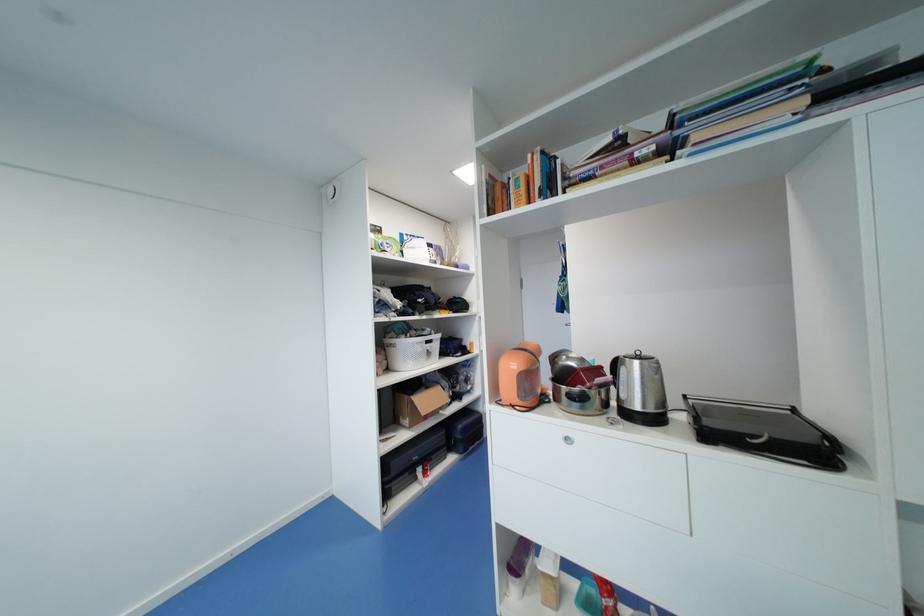
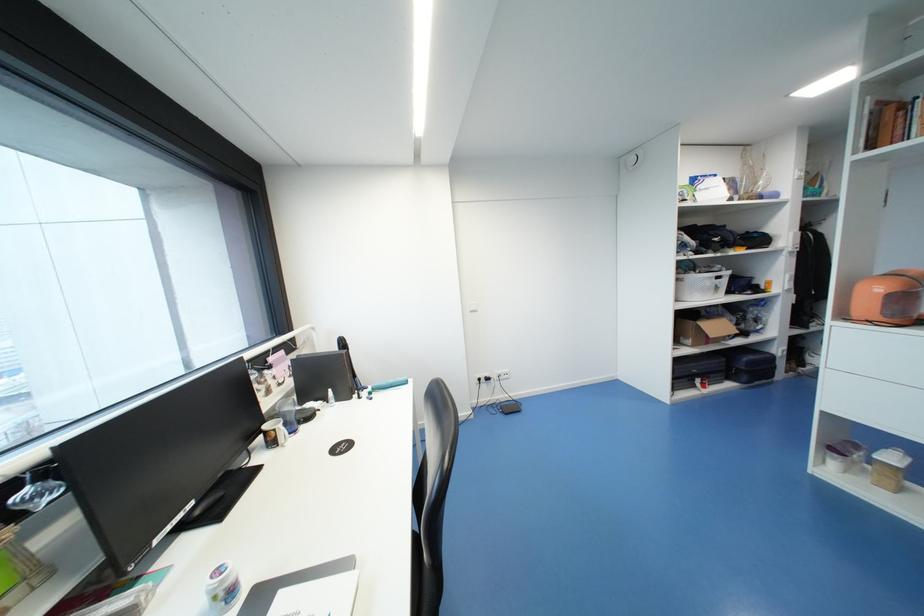
Where in the second image is the point corresponding to point 408,419 from the first image?

(690, 339)